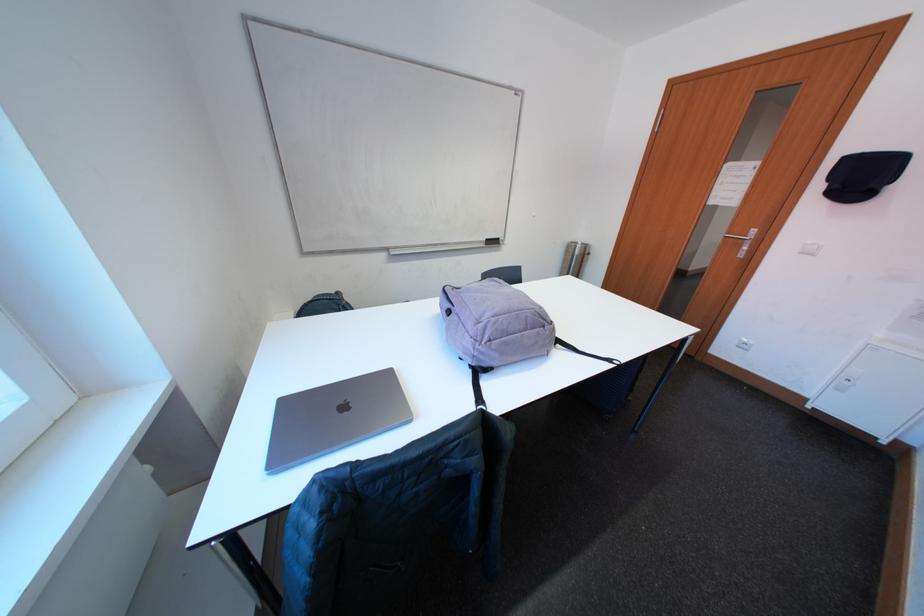
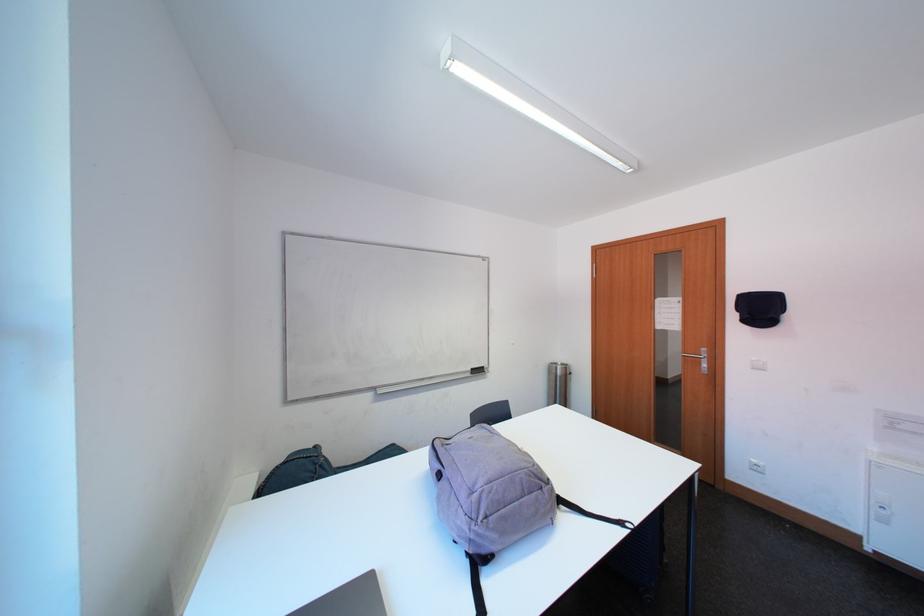
Where in the second image is the point corresponding to point (586, 251) from the first image?

(565, 371)